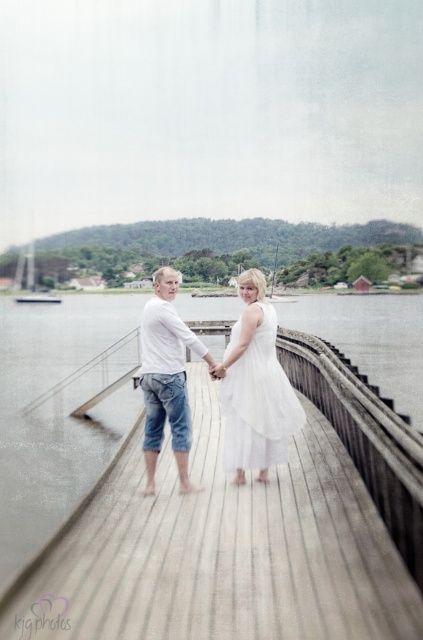
Question: Is white sheer dress at center below white cotton shirt at center?

Choices:
 (A) no
 (B) yes

Answer: (B)

Question: Estimate the real-world distances between objects in this image. Which object is closer to the white cotton shirt at center?

Choices:
 (A) white sheer dress at center
 (B) wooden at center
 (C) white cotton dress at center

Answer: (C)

Question: Which of the following is the farthest from the observer?

Choices:
 (A) wooden at center
 (B) white cotton shirt at center
 (C) white sheer dress at center

Answer: (C)

Question: Estimate the real-world distances between objects in this image. Which object is closer to the white cotton shirt at center?

Choices:
 (A) wooden at center
 (B) white cotton dress at center
 (C) white sheer dress at center

Answer: (B)

Question: Does white cotton dress at center have a greater width compared to white sheer dress at center?

Choices:
 (A) no
 (B) yes

Answer: (B)

Question: Is wooden at center thinner than white cotton dress at center?

Choices:
 (A) no
 (B) yes

Answer: (A)